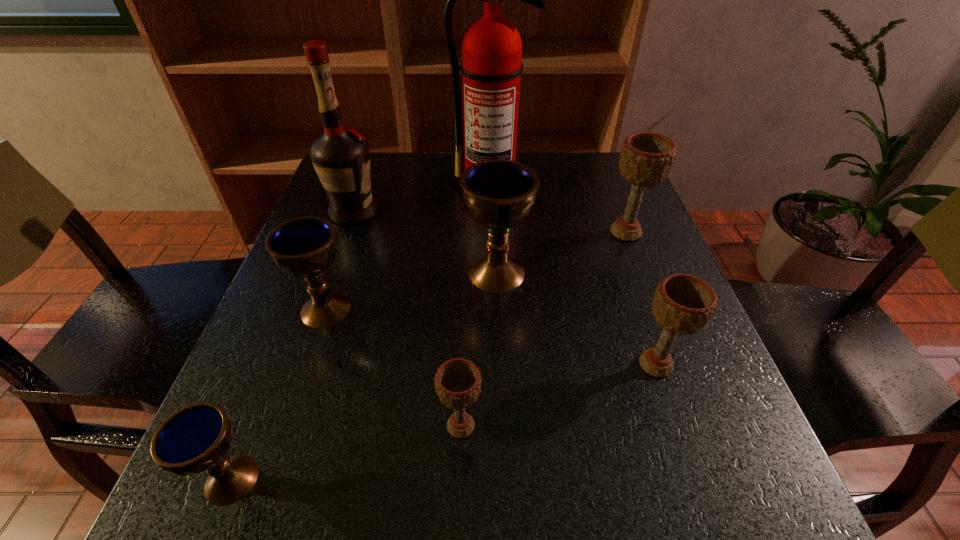
The height and width of the screenshot is (540, 960). Identify the location of free point that satisfies the following two spatial constraints: 1. on the side of the third nearest object near the handle; 2. on the right side of the tallest object. (496, 364).

Find the location of a particular element. vacant space that satisfies the following two spatial constraints: 1. on the back side of the second biggest beige chalice; 2. on the right side of the nearest blue chalice is located at coordinates (277, 364).

You are a GUI agent. You are given a task and a screenshot of the screen. Output one action in this format:
    pyautogui.click(x=<x>, y=<y>)
    Task: Click on the free space that satisfies the following two spatial constraints: 1. on the back side of the biggest blue chalice; 2. on the left side of the farthest chalice
    Image resolution: width=960 pixels, height=540 pixels.
    Given the screenshot: What is the action you would take?
    pyautogui.click(x=495, y=232)

You are a GUI agent. You are given a task and a screenshot of the screen. Output one action in this format:
    pyautogui.click(x=<x>, y=<y>)
    Task: Click on the free region that satisfies the following two spatial constraints: 1. on the front and back of the second smallest blue chalice; 2. on the left side of the liquor
    This screenshot has height=540, width=960.
    Given the screenshot: What is the action you would take?
    pyautogui.click(x=321, y=309)